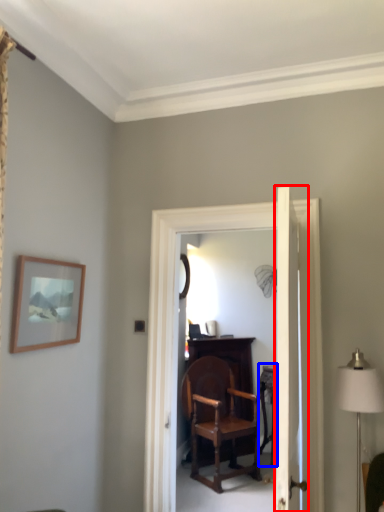
Question: Which object appears farthest to the camera in this image, door (highlighted by a red box) or table (highlighted by a blue box)?

Choices:
 (A) door
 (B) table

Answer: (B)